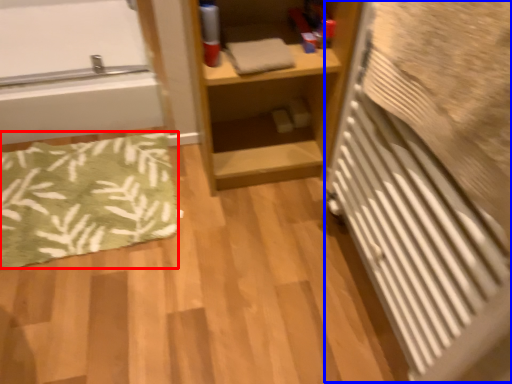
Question: Among these objects, which one is nearest to the camera, bath mat (highlighted by a red box) or radiator (highlighted by a blue box)?

Choices:
 (A) bath mat
 (B) radiator

Answer: (B)